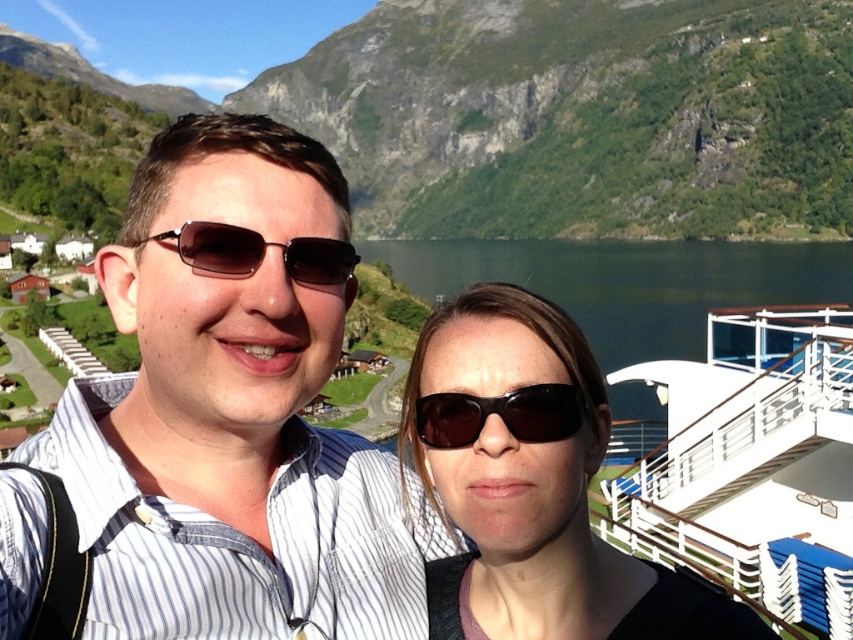
You are a photographer trying to capture the reflection of the white glossy boat at right in the water. However, the matte black sunglasses at center are blocking your view. Which object should you move to get an unobstructed view of the boat?

The matte black sunglasses at center is in front of the white glossy boat at right, so you should move the matte black sunglasses at center to get an unobstructed view of the boat.

You are a photographer trying to capture the matte black sunglasses at center in the image. What are the coordinates where you should focus your camera?

The coordinates to focus on are at point (532,484).